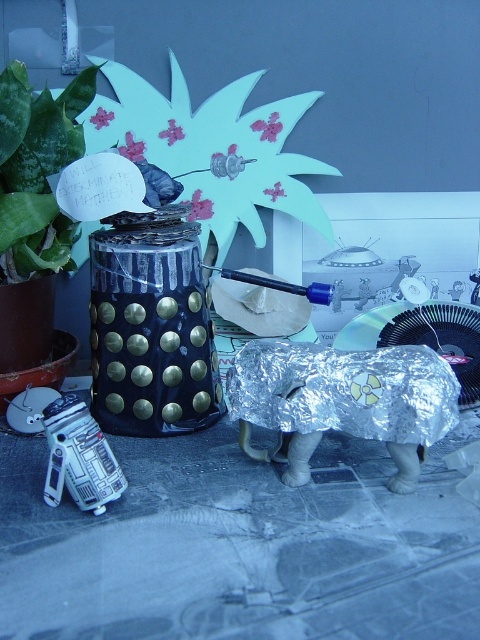
Does point (59, 259) lie behind point (80, 476)?

Yes, it is.

Describe the element at coordinates (36, 172) in the screenshot. I see `green leafy plant at upper left` at that location.

At what (x,y) coordinates should I click in order to perform the action: click on green leafy plant at upper left. Please return your answer as a coordinate pair (x, y). The height and width of the screenshot is (640, 480). Looking at the image, I should click on (36, 172).

Measure the distance from shiny metallic elephant at lower right to silver metallic r2-d2 at lower left.

A distance of 6.24 inches exists between shiny metallic elephant at lower right and silver metallic r2-d2 at lower left.

Where is `shiny metallic elephant at lower right`? shiny metallic elephant at lower right is located at coordinates (343, 401).

Between point (436, 358) and point (14, 154), which one is positioned in front?

Point (436, 358) is in front.

Does point (332, 387) come behind point (44, 173)?

That is False.

The image size is (480, 640). Find the location of `shiny metallic elephant at lower right`. shiny metallic elephant at lower right is located at coordinates (343, 401).